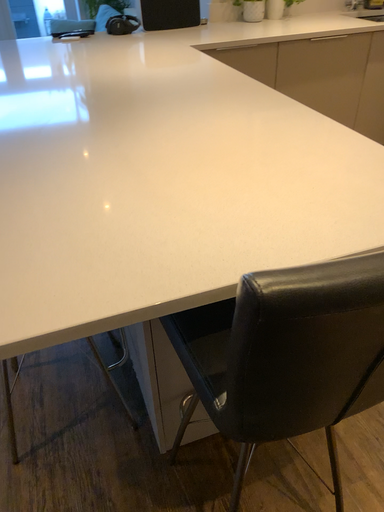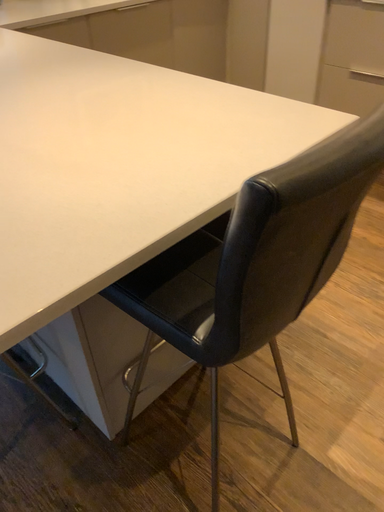
Question: Which way did the camera rotate in the video?

Choices:
 (A) rotated right
 (B) rotated left

Answer: (A)